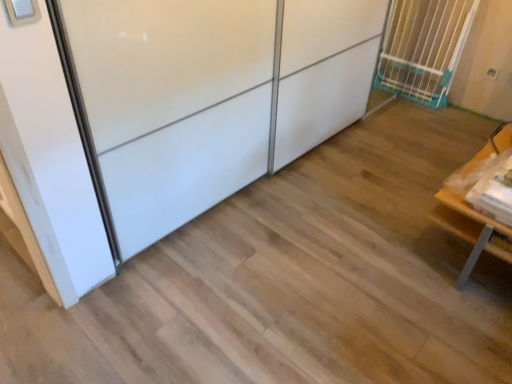
Where is `free space to the left of wooden table at right`? This screenshot has width=512, height=384. free space to the left of wooden table at right is located at coordinates (371, 252).